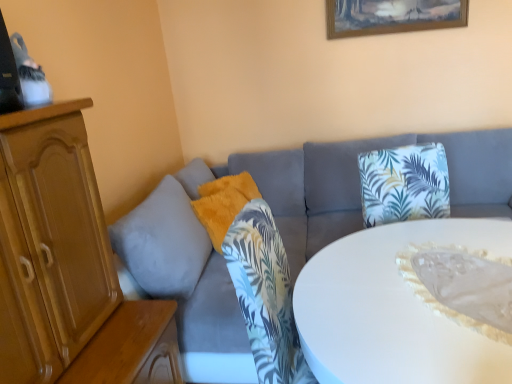
Question: Is wooden picture frame at upper center bigger or smaller than white glossy table at center?

Choices:
 (A) small
 (B) big

Answer: (A)

Question: Is wooden picture frame at upper center wider or thinner than white glossy table at center?

Choices:
 (A) thin
 (B) wide

Answer: (A)

Question: Which of these objects is positioned farthest from the white glossy table at center?

Choices:
 (A) velvet gray couch at center
 (B) wooden picture frame at upper center
 (C) fuzzy orange pillow at center

Answer: (B)

Question: Considering the real-world distances, which object is closest to the fuzzy orange pillow at center?

Choices:
 (A) wooden picture frame at upper center
 (B) velvet gray couch at center
 (C) white glossy table at center

Answer: (B)